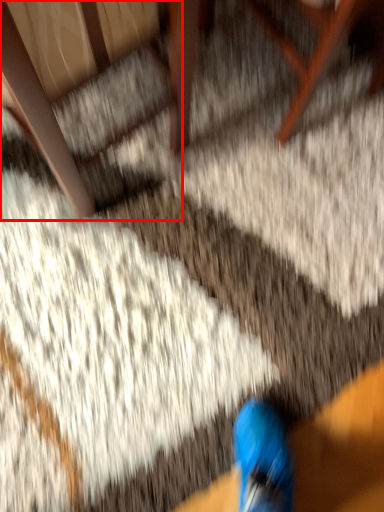
Question: From the image's perspective, where is armchair (annotated by the red box) located relative to furniture?

Choices:
 (A) below
 (B) above

Answer: (A)